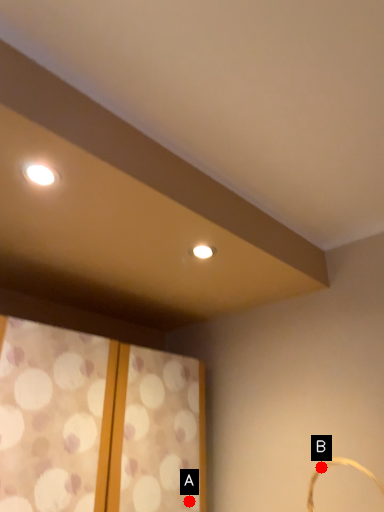
Question: Two points are circled on the image, labeled by A and B beside each circle. Which point appears closest to the camera in this image?

Choices:
 (A) A is closer
 (B) B is closer

Answer: (B)